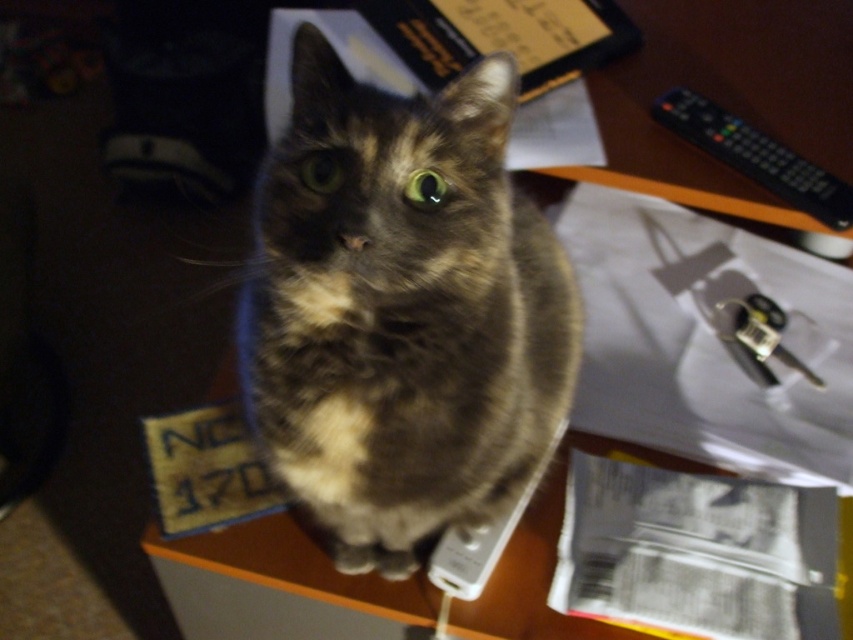
Question: Is the position of tabby fur cat at center more distant than that of black plastic remote at upper right?

Choices:
 (A) no
 (B) yes

Answer: (A)

Question: Is tabby fur cat at center in front of black plastic remote at upper right?

Choices:
 (A) no
 (B) yes

Answer: (B)

Question: Is tabby fur cat at center to the right of black plastic remote at upper right from the viewer's perspective?

Choices:
 (A) no
 (B) yes

Answer: (A)

Question: Which object is closer to the camera taking this photo?

Choices:
 (A) tabby fur cat at center
 (B) black plastic remote at upper right

Answer: (A)

Question: Which of the following is the closest to the observer?

Choices:
 (A) (280, 285)
 (B) (840, 202)

Answer: (A)